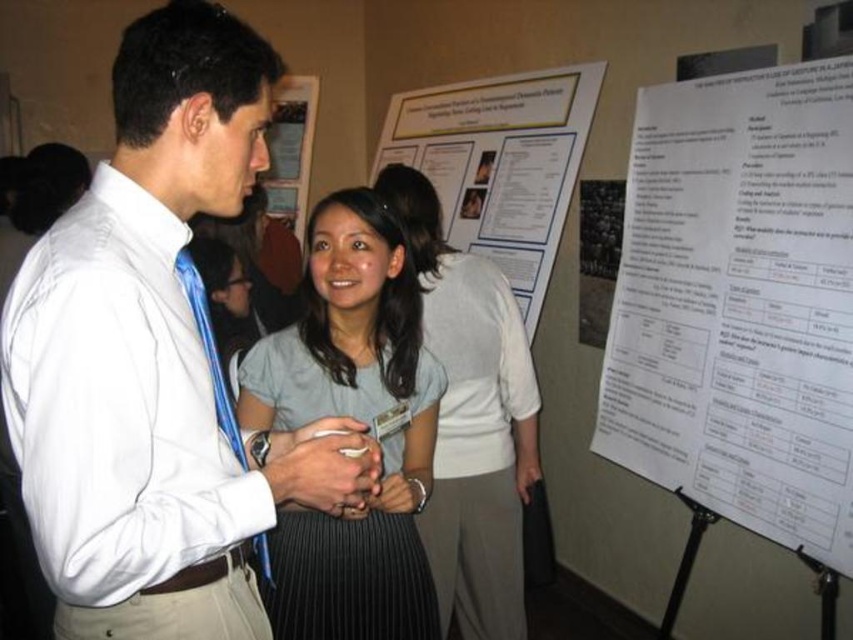
Does white paper poster at center appear on the right side of white paper at center?

Indeed, white paper poster at center is positioned on the right side of white paper at center.

Can you confirm if white paper poster at center is taller than white paper at center?

Yes.

Who is more forward, (502,104) or (314,99)?

Point (502,104) is more forward.

Image resolution: width=853 pixels, height=640 pixels. Identify the location of white paper poster at center. (498, 163).

Is light gray fabric shirt at center thinner than white paper at center?

Incorrect, light gray fabric shirt at center's width is not less than white paper at center's.

Consider the image. Does light gray fabric shirt at center appear over white paper at center?

Incorrect, light gray fabric shirt at center is not positioned above white paper at center.

The height and width of the screenshot is (640, 853). Describe the element at coordinates (471, 420) in the screenshot. I see `light gray fabric shirt at center` at that location.

This screenshot has width=853, height=640. What are the coordinates of `light gray fabric shirt at center` in the screenshot? It's located at 471,420.

Who is taller, white shirt at center or white paper poster at center?

Standing taller between the two is white paper poster at center.

Who is positioned more to the left, white shirt at center or white paper poster at center?

white shirt at center is more to the left.

Is point (184, 112) in front of point (527, 296)?

Yes.

The width and height of the screenshot is (853, 640). Find the location of `white shirt at center`. white shirt at center is located at coordinates (154, 358).